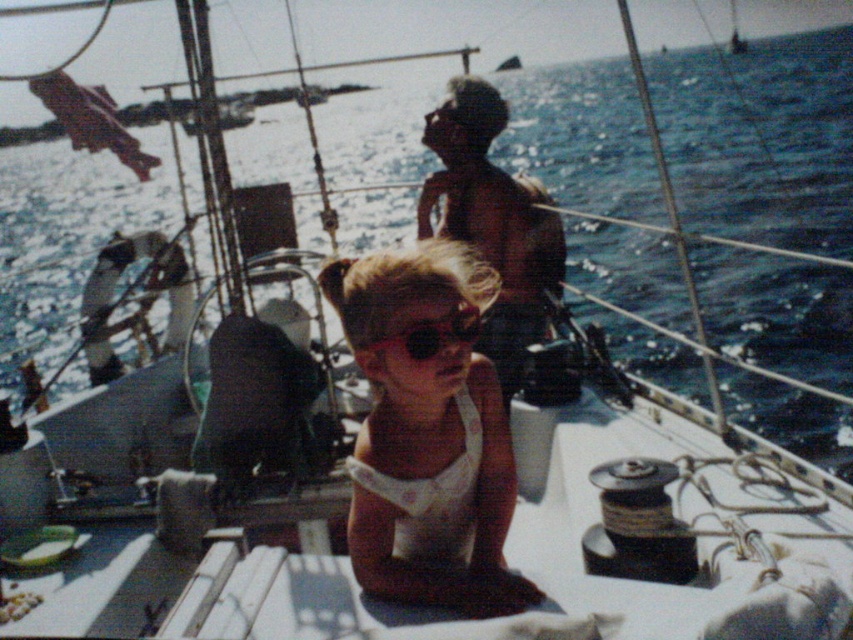
Which is more to the right, white fabric dress at center or brown skin at upper center?

Positioned to the right is brown skin at upper center.

Can you confirm if white fabric dress at center is positioned to the left of brown skin at upper center?

Correct, you'll find white fabric dress at center to the left of brown skin at upper center.

This screenshot has height=640, width=853. Find the location of `white fabric dress at center`. white fabric dress at center is located at coordinates (428, 432).

Who is taller, white fabric dress at center or black matte goggles at center?

white fabric dress at center is taller.

Does point (405, 496) come closer to viewer compared to point (450, 326)?

No, it is not.

Does point (438, 580) lie behind point (428, 336)?

Yes.

At what (x,y) coordinates should I click in order to perform the action: click on white fabric dress at center. Please return your answer as a coordinate pair (x, y). The image size is (853, 640). Looking at the image, I should click on (428, 432).

The height and width of the screenshot is (640, 853). I want to click on brown skin at upper center, so click(492, 220).

Does point (479, 147) lie in front of point (450, 310)?

That is False.

Find the location of a particular element. The image size is (853, 640). brown skin at upper center is located at coordinates tap(492, 220).

The image size is (853, 640). In order to click on brown skin at upper center in this screenshot , I will do `click(492, 220)`.